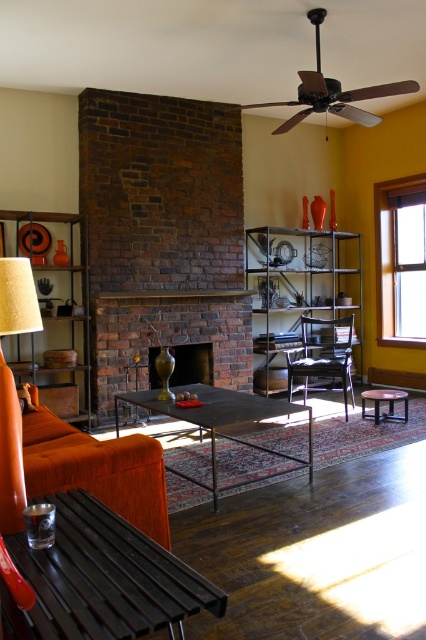
Question: Can you confirm if matte black bench at lower left is bigger than clear glass window at upper right?

Choices:
 (A) no
 (B) yes

Answer: (A)

Question: Which point is farther to the camera?

Choices:
 (A) (158, 376)
 (B) (141, 392)
 (C) (294, 358)

Answer: (C)

Question: In this image, where is brick fireplace at center located relative to clear glass window at upper right?

Choices:
 (A) right
 (B) left

Answer: (B)

Question: Which point appears closest to the camera in this image?

Choices:
 (A) [9, 301]
 (B) [394, 193]
 (C) [302, 308]

Answer: (A)

Question: Can you confirm if velvet orange couch at lower left is positioned above clear glass window at upper right?

Choices:
 (A) no
 (B) yes

Answer: (A)

Question: Which object is positioned closest to the matte black bench at lower left?

Choices:
 (A) matte bronze fireplace at center
 (B) brown wooden stool at lower right

Answer: (B)